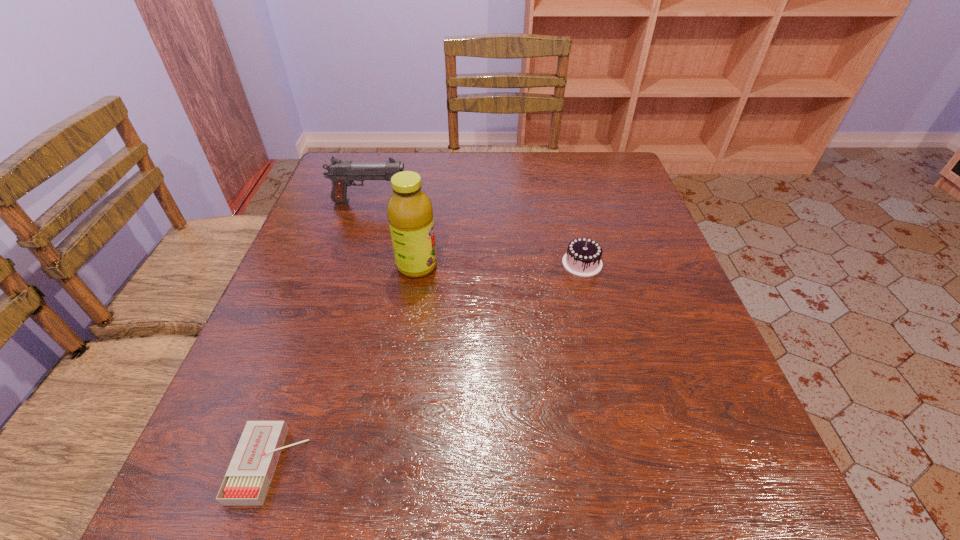
What are the coordinates of `the tallest object` in the screenshot? It's located at (409, 209).

Where is `the third object from left to right`? This screenshot has height=540, width=960. the third object from left to right is located at coordinates (409, 209).

At what (x,y) coordinates should I click in order to perform the action: click on the farthest object. Please return your answer as a coordinate pair (x, y). This screenshot has width=960, height=540. Looking at the image, I should click on (342, 173).

This screenshot has width=960, height=540. I want to click on gun, so click(342, 173).

Image resolution: width=960 pixels, height=540 pixels. I want to click on the second shortest object, so click(x=583, y=258).

You are a GUI agent. You are given a task and a screenshot of the screen. Output one action in this format:
    pyautogui.click(x=<x>, y=<y>)
    Task: Click on the rightmost object
    This screenshot has width=960, height=540.
    Given the screenshot: What is the action you would take?
    pyautogui.click(x=583, y=258)

Image resolution: width=960 pixels, height=540 pixels. Find the location of `matchbox`. matchbox is located at coordinates (247, 480).

In order to click on the shortest object in this screenshot , I will do `click(247, 480)`.

Where is `free space located 0.120m on the front label of the tallest object`? The width and height of the screenshot is (960, 540). free space located 0.120m on the front label of the tallest object is located at coordinates coord(492,266).

Identify the location of vacant position located in the direction the farthest object is aimed. (560, 201).